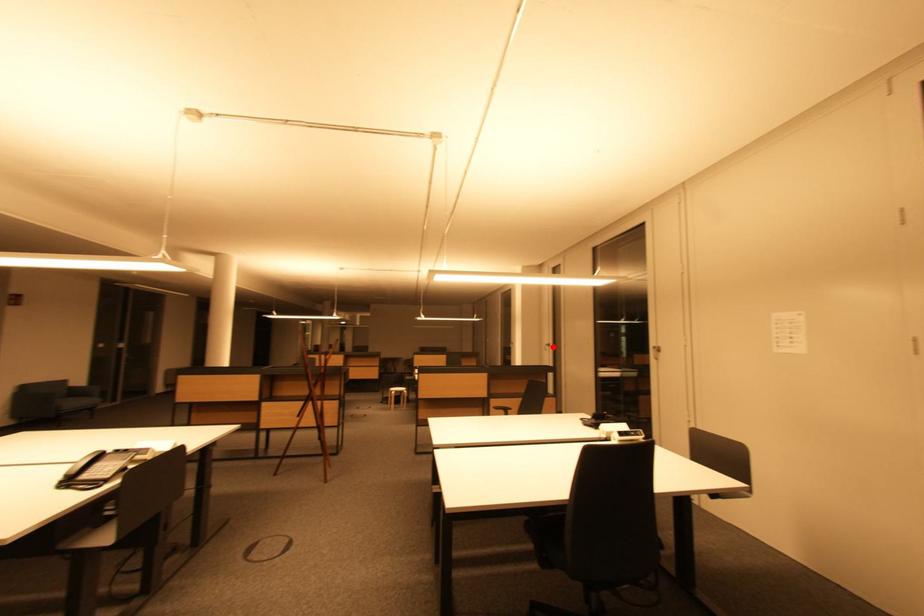
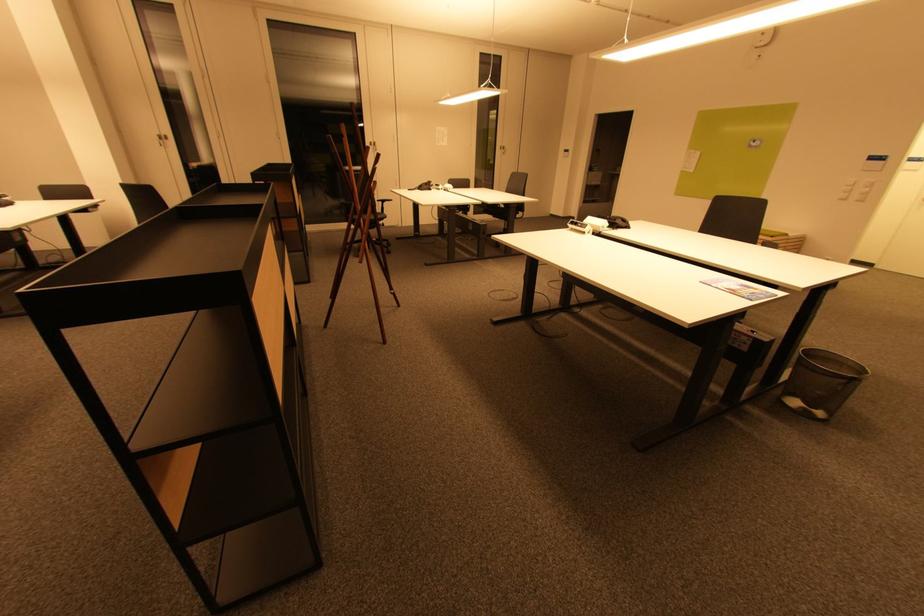
Question: I am providing you with two images of the same scene from different viewpoints. A red point is shown in image1. For the corresponding object point in image2, is it positioned nearer or farther from the camera?

Choices:
 (A) Nearer
 (B) Farther

Answer: (B)